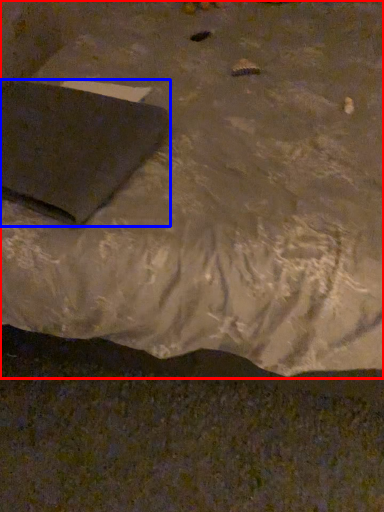
Question: Which object is further to the camera taking this photo, furniture (highlighted by a red box) or pad (highlighted by a blue box)?

Choices:
 (A) furniture
 (B) pad

Answer: (B)